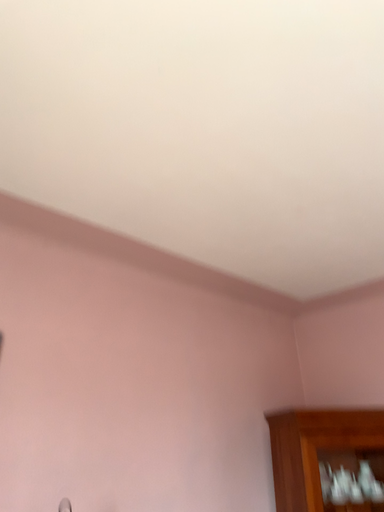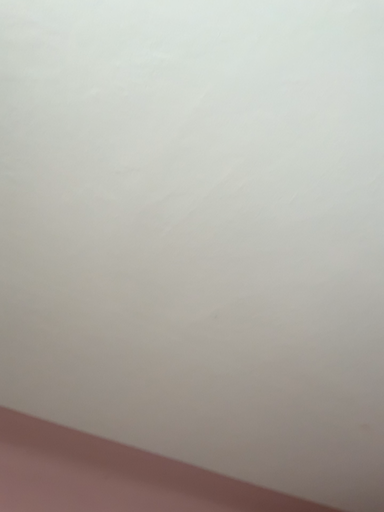
Question: Which way did the camera rotate in the video?

Choices:
 (A) rotated upward
 (B) rotated downward

Answer: (A)